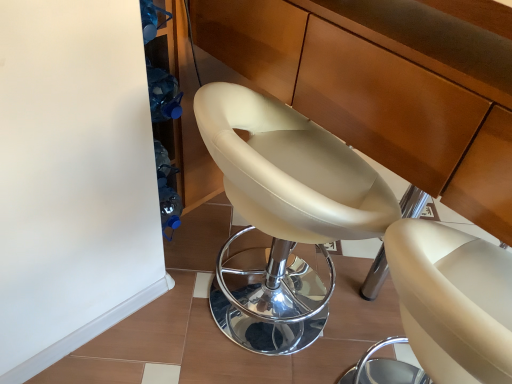
At what (x,y) coordinates should I click in order to perform the action: click on matte wood cabinet at center. Please return your answer as a coordinate pair (x, y). The width and height of the screenshot is (512, 384). Looking at the image, I should click on (385, 87).

Describe the element at coordinates (385, 87) in the screenshot. I see `matte wood cabinet at center` at that location.

This screenshot has width=512, height=384. I want to click on matte wood cabinet at center, so click(385, 87).